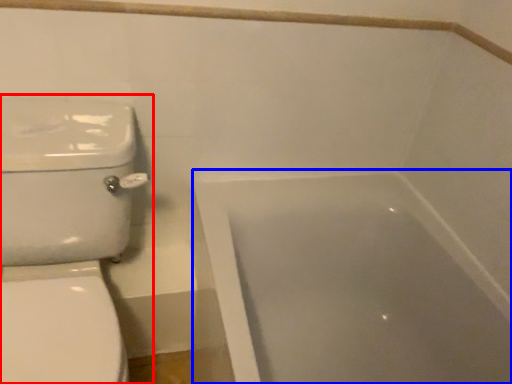
Question: Which point is closer to the camera, toilet (highlighted by a red box) or bathtub (highlighted by a blue box)?

Choices:
 (A) toilet
 (B) bathtub

Answer: (A)